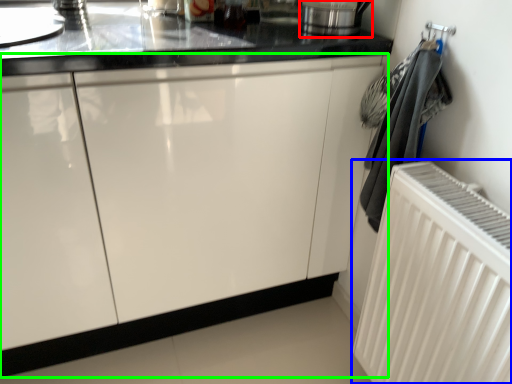
Question: Which object is the farthest from appliance (highlighted by a red box)? Choose among these: radiator (highlighted by a blue box) or cabinetry (highlighted by a green box).

Choices:
 (A) radiator
 (B) cabinetry

Answer: (A)